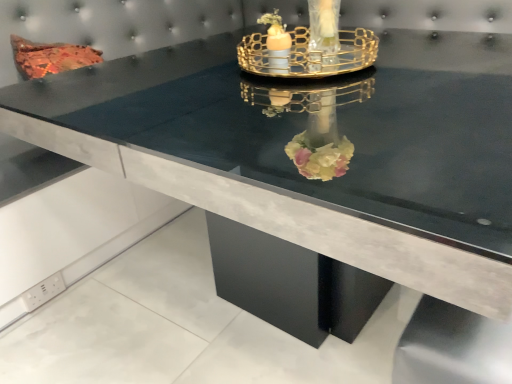
What do you see at coordinates (307, 46) in the screenshot? The width and height of the screenshot is (512, 384). I see `gold metallic tray at center` at bounding box center [307, 46].

Where is `gold metallic tray at center`? The height and width of the screenshot is (384, 512). gold metallic tray at center is located at coordinates (307, 46).

This screenshot has width=512, height=384. I want to click on gold metallic tray at center, so click(x=307, y=46).